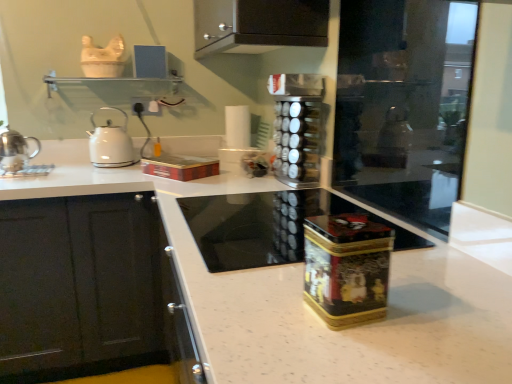
Question: Is black metallic spice rack at center, marked as the 1th appliance in a back-to-front arrangement, positioned with its back to metallic red box at center?

Choices:
 (A) yes
 (B) no

Answer: (B)

Question: From a real-world perspective, does black metallic spice rack at center, placed as the first appliance when sorted from top to bottom, sit lower than metallic red box at center?

Choices:
 (A) no
 (B) yes

Answer: (A)

Question: Is black metallic spice rack at center, marked as the 1th appliance in a back-to-front arrangement, positioned in front of metallic red box at center?

Choices:
 (A) yes
 (B) no

Answer: (A)

Question: Would you say black metallic spice rack at center, positioned as the second appliance in bottom-to-top order, is outside metallic red box at center?

Choices:
 (A) yes
 (B) no

Answer: (A)

Question: From the image's perspective, is black metallic spice rack at center, which appears as the 2th appliance when viewed from the front, located above metallic red box at center?

Choices:
 (A) yes
 (B) no

Answer: (A)

Question: From the image's perspective, is black glass cooktop at center positioned above or below shiny silver teapot at left, which is counted as the 1th kitchen appliance, starting from the front?

Choices:
 (A) above
 (B) below

Answer: (B)

Question: Considering the positions of black glass cooktop at center and shiny silver teapot at left, which is the first kitchen appliance from left to right, in the image, is black glass cooktop at center wider or thinner than shiny silver teapot at left, which is the first kitchen appliance from left to right,?

Choices:
 (A) thin
 (B) wide

Answer: (B)

Question: Is black glass cooktop at center taller or shorter than shiny silver teapot at left, acting as the second kitchen appliance starting from the back?

Choices:
 (A) tall
 (B) short

Answer: (B)

Question: Considering the positions of black glass cooktop at center and shiny silver teapot at left, which is counted as the 1th kitchen appliance, starting from the front, in the image, is black glass cooktop at center bigger or smaller than shiny silver teapot at left, which is counted as the 1th kitchen appliance, starting from the front,?

Choices:
 (A) small
 (B) big

Answer: (B)

Question: In terms of height, does transparent glass screen door at right look taller or shorter compared to black metallic spice rack at center, placed as the first appliance when sorted from top to bottom?

Choices:
 (A) short
 (B) tall

Answer: (B)

Question: Would you say transparent glass screen door at right is to the left or to the right of black metallic spice rack at center, marked as the 1th appliance in a back-to-front arrangement, in the picture?

Choices:
 (A) right
 (B) left

Answer: (A)

Question: Is transparent glass screen door at right inside or outside of black metallic spice rack at center, positioned as the second appliance in bottom-to-top order?

Choices:
 (A) outside
 (B) inside

Answer: (A)

Question: Is point 437,6 positioned closer to the camera than point 302,122?

Choices:
 (A) farther
 (B) closer

Answer: (A)

Question: In the image, is transparent glass screen door at right positioned in front of or behind white speckled granite at center?

Choices:
 (A) front
 (B) behind

Answer: (B)

Question: Considering the positions of transparent glass screen door at right and white speckled granite at center in the image, is transparent glass screen door at right wider or thinner than white speckled granite at center?

Choices:
 (A) thin
 (B) wide

Answer: (A)